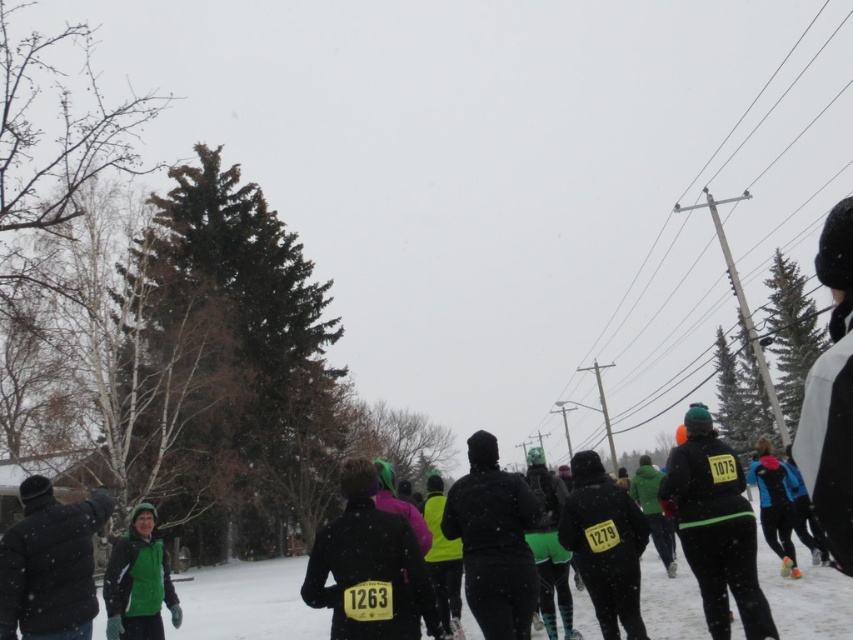
Question: Can you confirm if dark green jacket at lower left is bigger than green fleece jacket at lower left?

Choices:
 (A) no
 (B) yes

Answer: (A)

Question: Which point is farther to the camera?

Choices:
 (A) dark green jacket at lower left
 (B) black matte jacket at center
 (C) green fleece jacket at lower left

Answer: (C)

Question: Which object is the closest to the green fleece jacket at lower left?

Choices:
 (A) dark green jacket at lower left
 (B) black matte jacket at center

Answer: (A)

Question: Estimate the real-world distances between objects in this image. Which object is closer to the dark green jacket at lower left?

Choices:
 (A) black matte jacket at center
 (B) green fleece jacket at lower left

Answer: (B)

Question: Does black matte jacket at center have a lesser width compared to green fleece jacket at lower left?

Choices:
 (A) no
 (B) yes

Answer: (A)

Question: Is black matte jacket at center behind green fleece jacket at lower left?

Choices:
 (A) no
 (B) yes

Answer: (A)